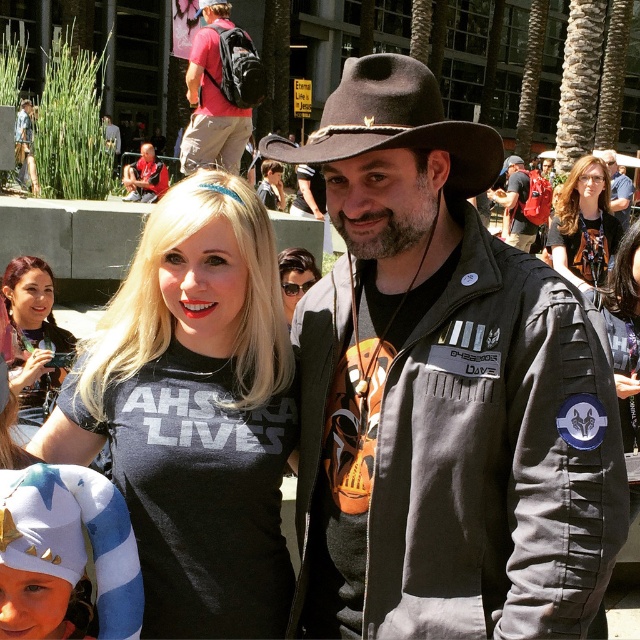
You are standing in the crowd at this event and want to take a photo of both the point at coordinates (x=428, y=380) and the point at coordinates (x=493, y=189). Which point will appear larger in your photo?

Point at coordinates (x=428, y=380) will appear larger in the photo because it is closer to the camera than point at coordinates (x=493, y=189).